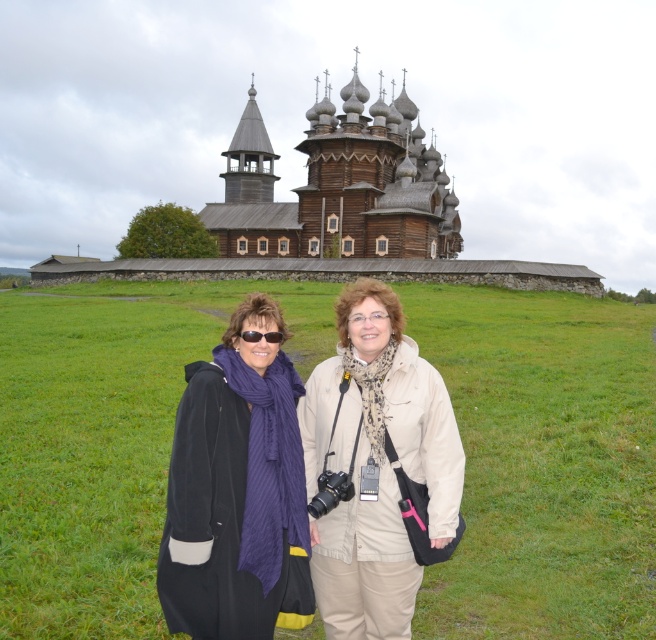
Question: Is green grass at center to the left of black plastic goggles at center from the viewer's perspective?

Choices:
 (A) yes
 (B) no

Answer: (A)

Question: Which of the following is the farthest from the observer?

Choices:
 (A) (253, 339)
 (B) (562, 484)
 (C) (298, 522)

Answer: (B)

Question: Observing the image, what is the correct spatial positioning of black fabric coat at center in reference to black plastic goggles at center?

Choices:
 (A) left
 (B) right

Answer: (B)

Question: Among these points, which one is nearest to the camera?

Choices:
 (A) (266, 481)
 (B) (201, 513)

Answer: (B)

Question: Which object is positioned closest to the green grass at center?

Choices:
 (A) purple wool scarf at left
 (B) black plastic goggles at center

Answer: (A)

Question: Is purple wool scarf at left closer to the viewer compared to black plastic goggles at center?

Choices:
 (A) yes
 (B) no

Answer: (A)